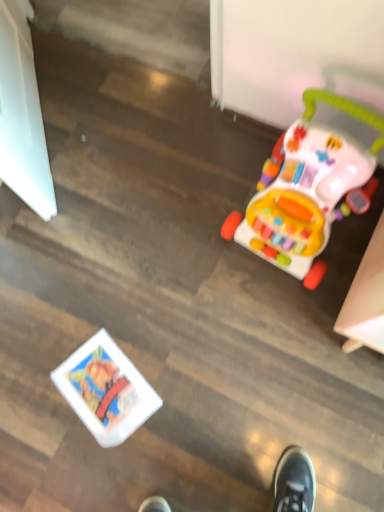
Find the location of a particular element. The height and width of the screenshot is (512, 384). vacant space positioned to the left of white glossy book at lower left, which is the 2th toy from right to left is located at coordinates (38, 404).